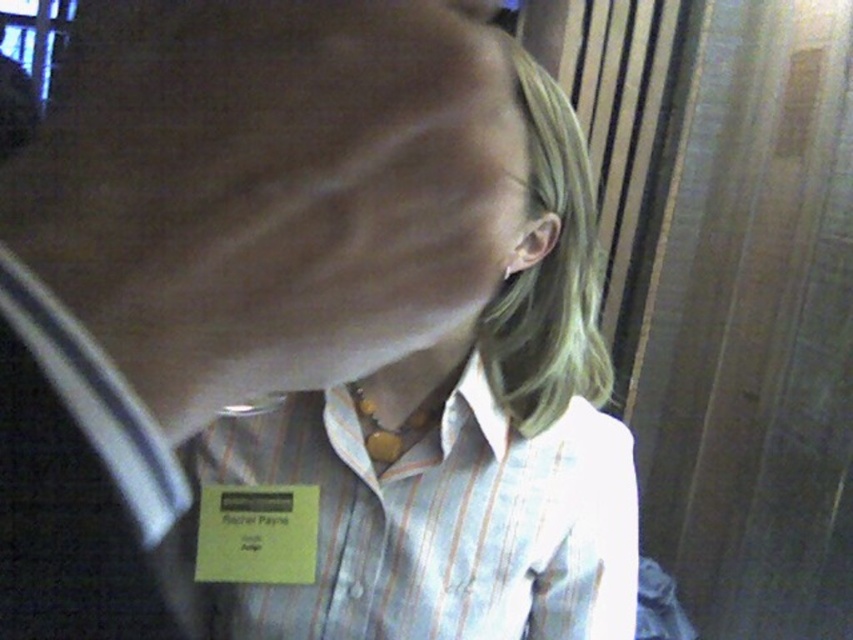
Which is more to the left, white striped shirt at center or white striped dress shirt at center?

Positioned to the left is white striped dress shirt at center.

Locate an element on the screen. The image size is (853, 640). white striped shirt at center is located at coordinates (461, 449).